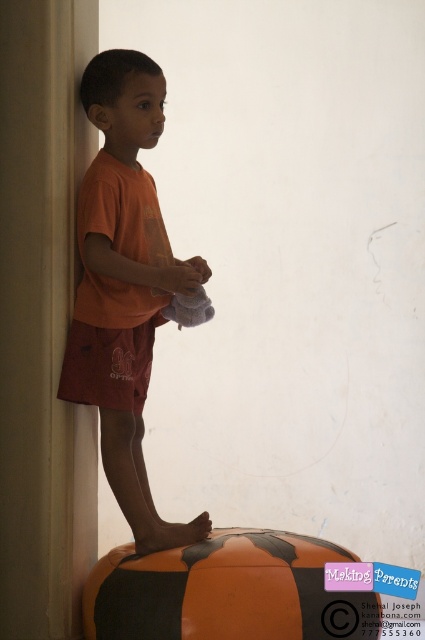
Is point (136, 605) positioned behind point (119, 353)?

That is False.

Where is `orange matte beach ball at lower center`? The image size is (425, 640). orange matte beach ball at lower center is located at coordinates (226, 592).

Does smooth beige pillar at left have a smaller size compared to orange matte beach ball at lower center?

No, smooth beige pillar at left is not smaller than orange matte beach ball at lower center.

Is point (48, 404) positioned after point (215, 566)?

Yes, it is behind point (215, 566).

Locate an element on the screen. The height and width of the screenshot is (640, 425). smooth beige pillar at left is located at coordinates (42, 320).

Can you confirm if orange cotton shirt at center is positioned above orange matte beach ball at lower center?

Yes, orange cotton shirt at center is above orange matte beach ball at lower center.

Which of these two, orange cotton shirt at center or orange matte beach ball at lower center, stands taller?

Standing taller between the two is orange cotton shirt at center.

Between point (81, 189) and point (104, 561), which one is positioned behind?

Point (104, 561)

At what (x,y) coordinates should I click in order to perform the action: click on orange cotton shirt at center. Please return your answer as a coordinate pair (x, y). The image size is (425, 640). Looking at the image, I should click on (124, 284).